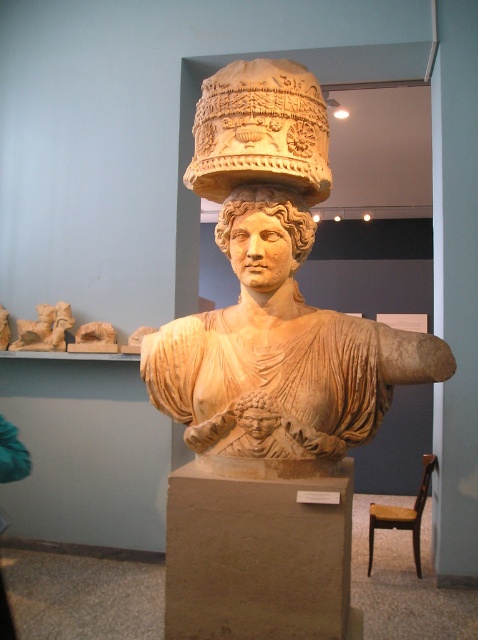
You are a visitor at the museum and want to take a photo of the matte beige head at center without the beige stone pedestal at center blocking the view. Is this possible based on their positions?

The beige stone pedestal at center is in front of the matte beige head at center, so the pedestal will block the view of the head. You cannot take a photo of the matte beige head at center without the beige stone pedestal at center blocking the view.

You are a museum curator who needs to place a protective glass case around the beige stone bust at center. The case requires a minimum of 1.7 meters of space between the case and any nearby objects to ensure safety. Is the current spacing sufficient?

The beige stone bust at center is 1.66 meters apart from the nearby objects. Since the required minimum space is 1.7 meters, the current spacing is insufficient to meet the safety requirement.

You are a museum curator planning to move the beige stone pedestal at center and the matte stone head at center to a new exhibition space. The new space has a height restriction of 1.8 meters. Given that the combined height of both objects is 1.6 meters, can they be displayed together without exceeding the height limit?

The beige stone pedestal at center and the matte stone head at center have a combined height of 1.6 meters, which is under the 1.8 meters height restriction. Therefore, they can be displayed together without exceeding the limit.